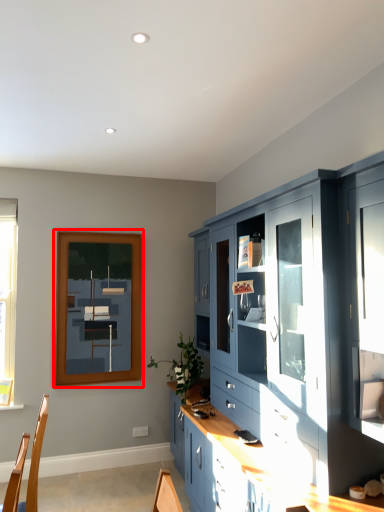
Question: From the image's perspective, where is picture frame (annotated by the red box) located in relation to cabinetry in the image?

Choices:
 (A) above
 (B) below

Answer: (A)